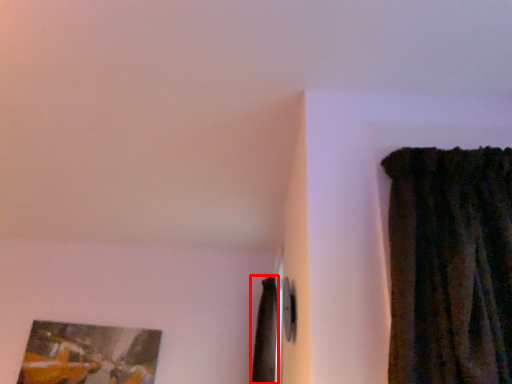
Question: From the image's perspective, considering the relative positions of curtain (annotated by the red box) and picture frame in the image provided, where is curtain (annotated by the red box) located with respect to the staircase?

Choices:
 (A) below
 (B) above

Answer: (B)